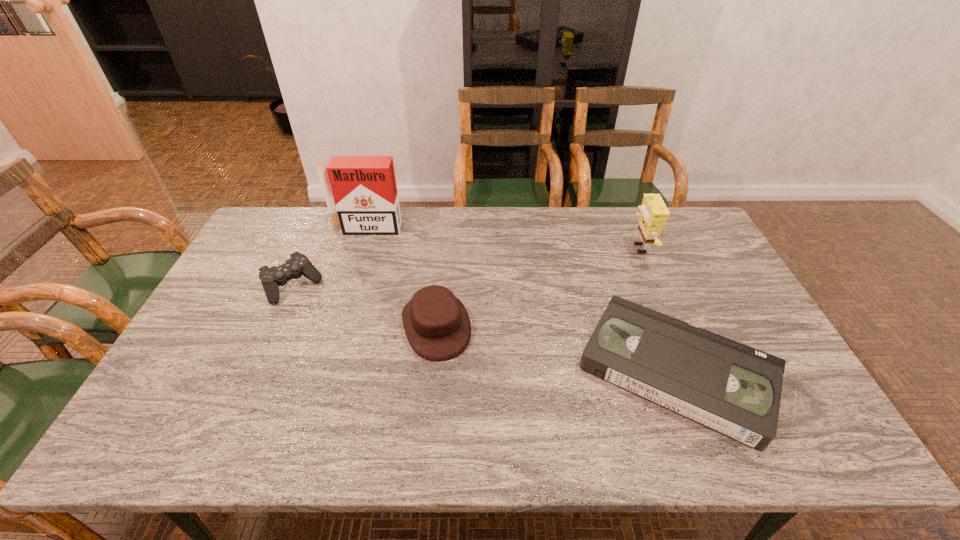
The image size is (960, 540). I want to click on vacant space located 0.110m on the front of the fourth tallest object, so point(272,336).

At what (x,y) coordinates should I click in order to perform the action: click on vacant area situated on the back of the shortest object. Please return your answer as a coordinate pair (x, y). This screenshot has width=960, height=540. Looking at the image, I should click on (627, 243).

At what (x,y) coordinates should I click in order to perform the action: click on cigarette case positioned at the far edge. Please return your answer as a coordinate pair (x, y). The height and width of the screenshot is (540, 960). Looking at the image, I should click on (364, 189).

You are a GUI agent. You are given a task and a screenshot of the screen. Output one action in this format:
    pyautogui.click(x=<x>, y=<y>)
    Task: Click on the sponge at the far edge
    Image resolution: width=960 pixels, height=540 pixels.
    Given the screenshot: What is the action you would take?
    pyautogui.click(x=654, y=213)

Find the location of `object at the near edge`. object at the near edge is located at coordinates (731, 388).

Where is `object located at the left edge`? object located at the left edge is located at coordinates (298, 265).

I want to click on object present at the right edge, so click(x=731, y=388).

Identify the location of object that is at the near right corner. (731, 388).

In the image, there is a desktop. At what (x,y) coordinates should I click in order to perform the action: click on vacant space at the far edge. Please return your answer as a coordinate pair (x, y). This screenshot has height=540, width=960. Looking at the image, I should click on (511, 221).

Find the location of a particular element. vacant space at the left edge of the desktop is located at coordinates click(x=204, y=408).